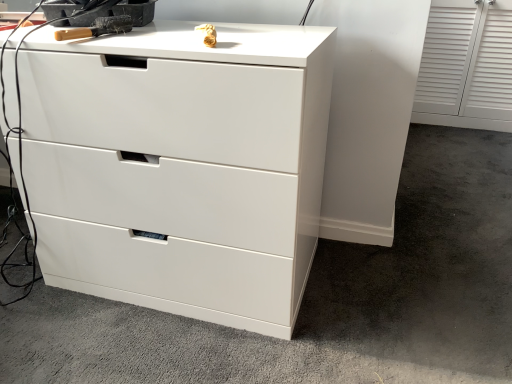
This screenshot has height=384, width=512. What are the coordinates of `free spot to the right of wooden-handled brush at upper left` in the screenshot? It's located at coord(158,36).